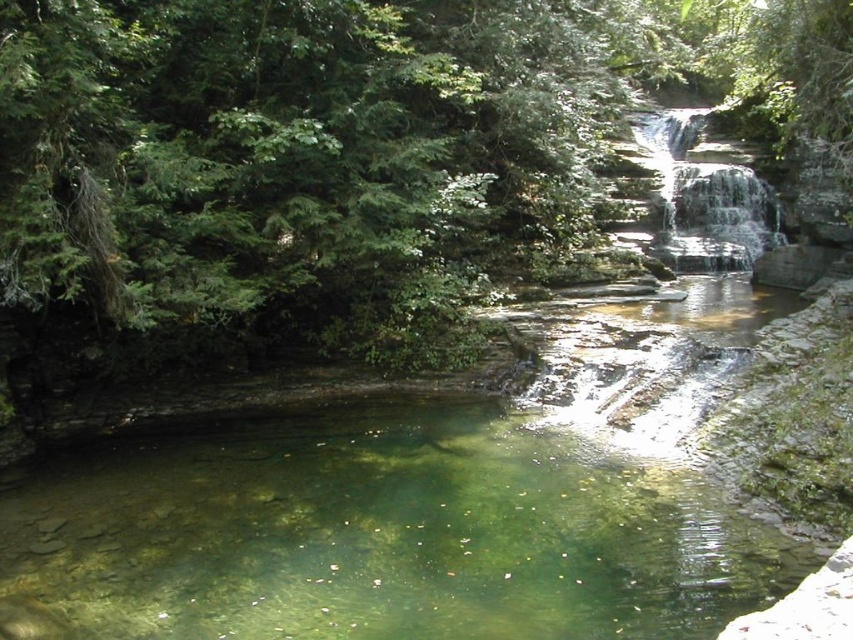
Based on the photo, you are planning to cross the clear water at center to reach the other side. The clear stone waterfall at upper center is flowing above you. Considering their widths, which one do you think is wider?

The clear water at center is wider than the clear stone waterfall at upper center, so the clear water at center is wider.

You are standing at the edge of the pool and see two points marked in the scene. The first point is at coordinates point (469, 493) and the second point is at point (700, 120). Which point is closer to you?

Point (469, 493) is in front of point (700, 120), so it is closer to you.